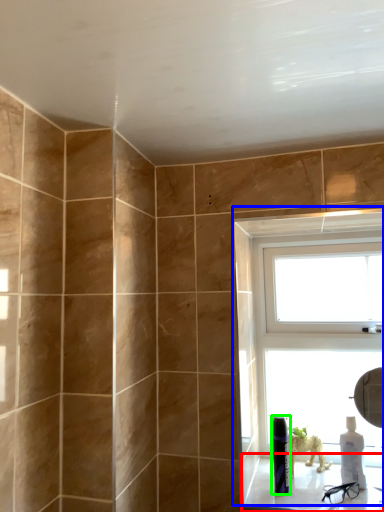
Question: Considering the real-world distances, which object is farthest from window sill (highlighted by a red box)? window (highlighted by a blue box) or toiletry (highlighted by a green box)?

Choices:
 (A) window
 (B) toiletry

Answer: (A)